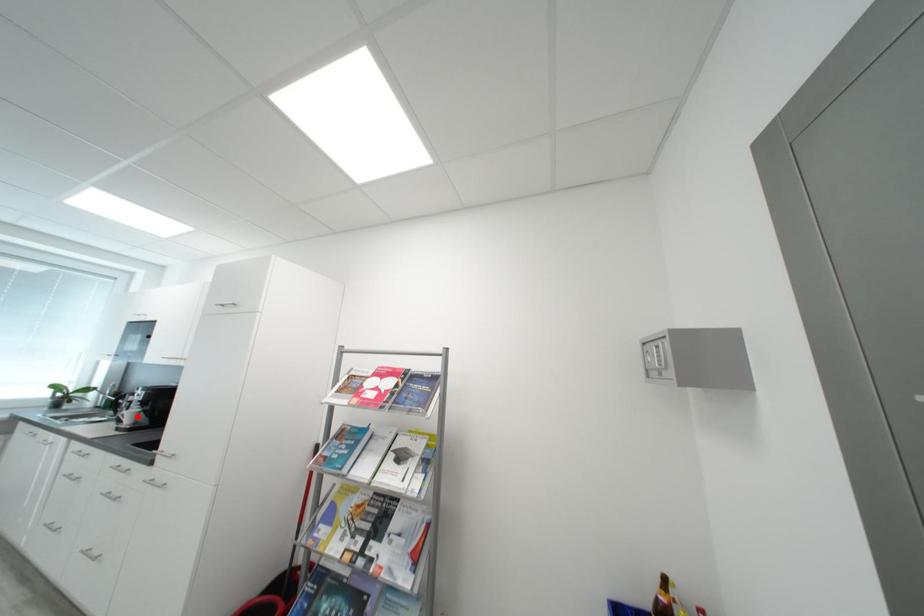
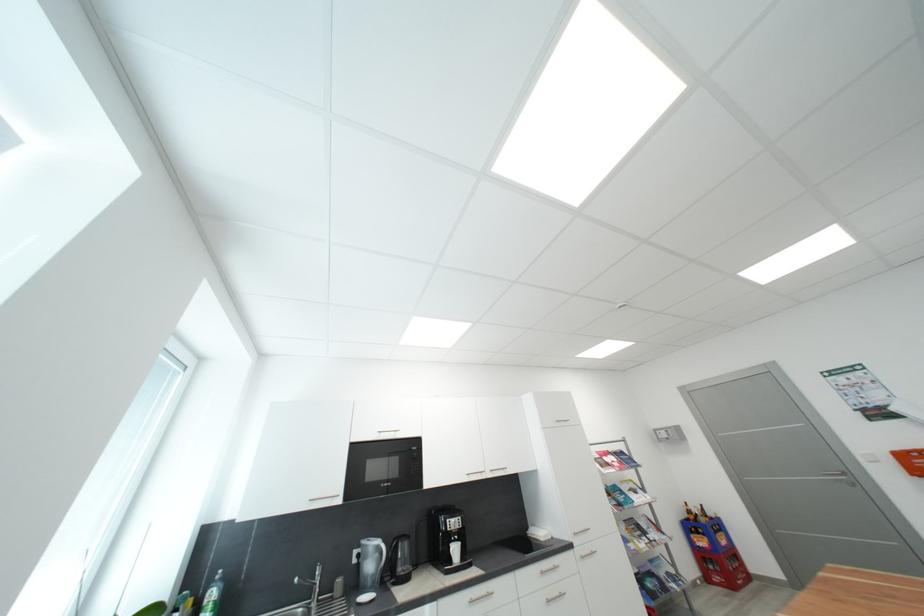
Question: I am providing you with two images of the same scene from different viewpoints. In image1, a red point is highlighted. Considering the same 3D point in image2, which of the following is correct?

Choices:
 (A) It is closer
 (B) It is farther

Answer: (B)